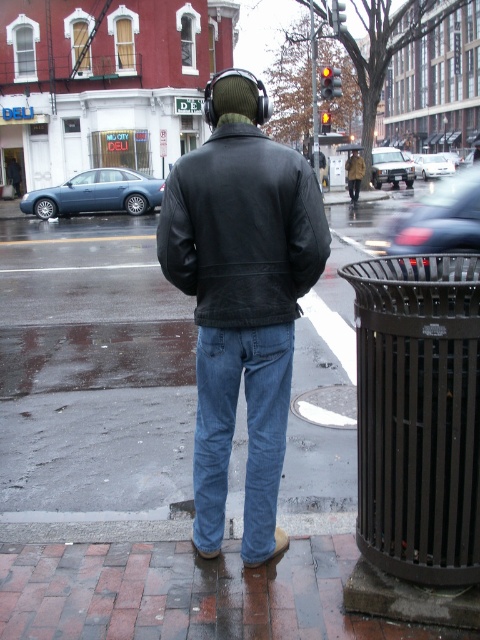
Describe the element at coordinates (240, 298) in the screenshot. I see `matte black leather jacket at center` at that location.

Can you confirm if matte black leather jacket at center is wider than denim jeans at center?

Correct, the width of matte black leather jacket at center exceeds that of denim jeans at center.

Who is more distant from viewer, (286, 252) or (250, 435)?

Positioned behind is point (250, 435).

The height and width of the screenshot is (640, 480). Identify the location of matte black leather jacket at center. (240, 298).

Is metallic silver car at right bigger than matte blue sedan at left?

Yes.

Find the location of a particular element. metallic silver car at right is located at coordinates (437, 220).

The height and width of the screenshot is (640, 480). I want to click on metallic silver car at right, so click(x=437, y=220).

Can you confirm if tan leather jacket at center is positioned above camouflage fabric jacket at center?

No.

Does point (358, 195) come behind point (354, 157)?

That is False.

Locate an element on the screen. The width and height of the screenshot is (480, 640). tan leather jacket at center is located at coordinates (355, 173).